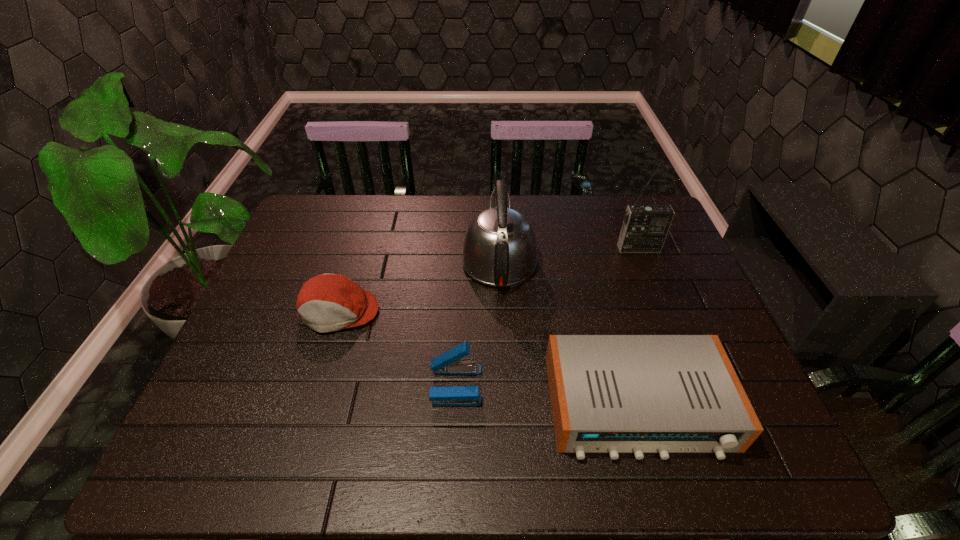
Identify the location of free location located 0.230m on the front-facing side of the leftmost object. This screenshot has width=960, height=540. (306, 420).

At what (x,y) coordinates should I click in order to perform the action: click on free space located on the left of the stapler. Please return your answer as a coordinate pair (x, y). This screenshot has width=960, height=540. Looking at the image, I should click on (399, 385).

The height and width of the screenshot is (540, 960). Find the location of `object present at the far edge`. object present at the far edge is located at coordinates (499, 249).

The image size is (960, 540). I want to click on object present at the near edge, so click(613, 394).

Find the location of a particular element. The width and height of the screenshot is (960, 540). object located in the left edge section of the desktop is located at coordinates tap(328, 302).

Image resolution: width=960 pixels, height=540 pixels. In order to click on object located at the near right corner in this screenshot , I will do `click(613, 394)`.

Where is `vacant space at the far edge of the desktop`? This screenshot has height=540, width=960. vacant space at the far edge of the desktop is located at coordinates (579, 197).

Find the location of a particular element. vacant space at the left edge of the desktop is located at coordinates (276, 297).

I want to click on blank space at the right edge of the desktop, so click(x=701, y=329).

Where is `vacant space at the far left corner of the desktop`? vacant space at the far left corner of the desktop is located at coordinates (314, 227).